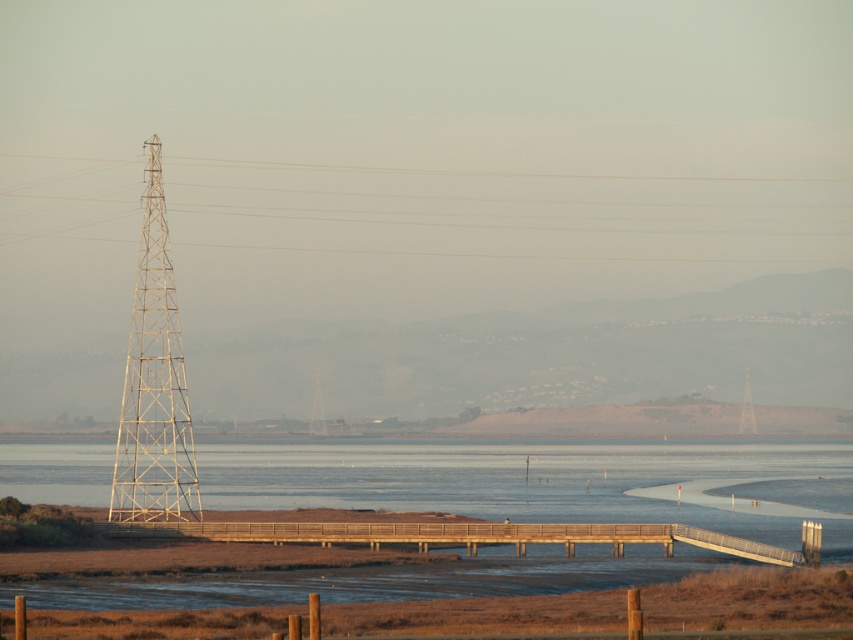
Question: Which object appears closest to the camera in this image?

Choices:
 (A) metallic lattice tower at left
 (B) metallic tower at right
 (C) clear water at center
 (D) metallic silver tower at left

Answer: (A)

Question: Is clear water at center closer to camera compared to metallic tower at right?

Choices:
 (A) yes
 (B) no

Answer: (A)

Question: Based on their relative distances, which object is farther from the metallic lattice tower at left?

Choices:
 (A) clear water at center
 (B) metallic silver tower at left

Answer: (A)

Question: Can you confirm if metallic silver tower at left is wider than metallic tower at right?

Choices:
 (A) yes
 (B) no

Answer: (A)

Question: Is clear water at center wider than metallic silver tower at left?

Choices:
 (A) no
 (B) yes

Answer: (A)

Question: Which point is closer to the camera?

Choices:
 (A) metallic lattice tower at left
 (B) metallic tower at right

Answer: (A)